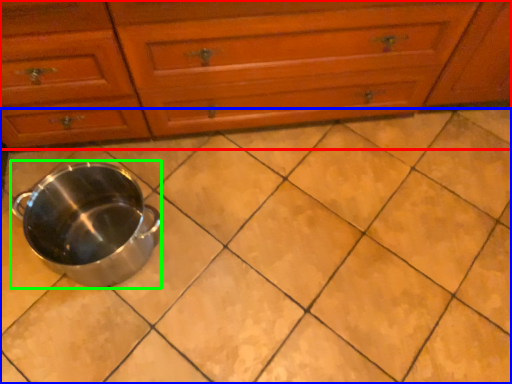
Question: Which is nearer to the chest of drawers (highlighted by a red box)? ceramic tile (highlighted by a blue box) or crock pot (highlighted by a green box).

Choices:
 (A) ceramic tile
 (B) crock pot

Answer: (B)